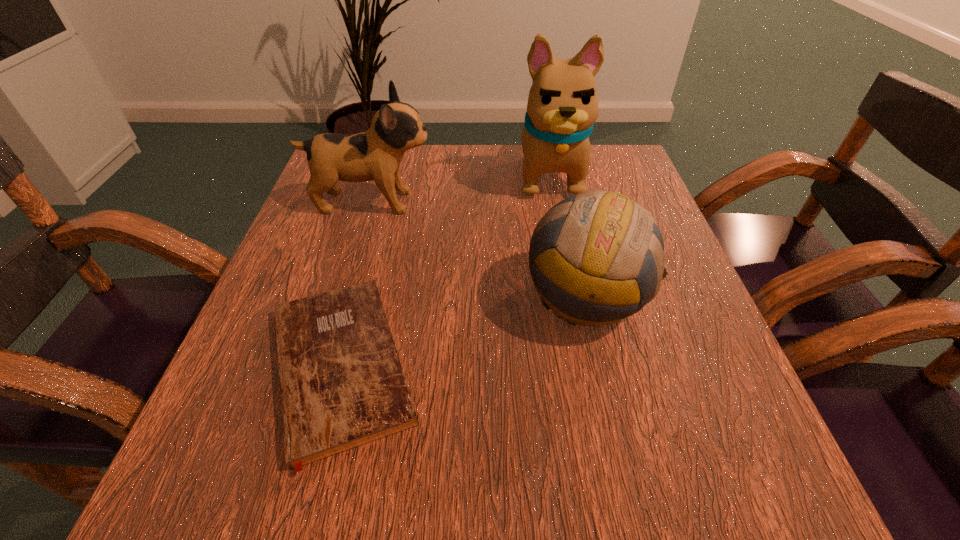
This screenshot has width=960, height=540. What are the coordinates of `vacant area that lies between the tallest object and the shortest object` in the screenshot? It's located at (444, 270).

Locate an element on the screen. free area in between the shorter puppy and the right puppy is located at coordinates pyautogui.click(x=460, y=188).

Identify which object is the third nearest to the right puppy. Please provide its 2D coordinates. Your answer should be formatted as a tuple, i.e. [(x, y)], where the tuple contains the x and y coordinates of a point satisfying the conditions above.

[(342, 385)]

Identify the location of the third closest object to the second shortest object. (376, 154).

The image size is (960, 540). Identify the location of free space that satisfies the following two spatial constraints: 1. at the face of the third shortest object; 2. on the back side of the volleyball. click(343, 298).

At what (x,y) coordinates should I click in order to perform the action: click on blank area in the image that satisfies the following two spatial constraints: 1. at the face of the left puppy; 2. on the right side of the shortest object. Please return your answer as a coordinate pair (x, y). Looking at the image, I should click on (323, 366).

In order to click on vacant region that satisfies the following two spatial constraints: 1. on the face of the second shortest object; 2. on the right side of the taller puppy in this screenshot , I will do `click(574, 298)`.

Where is `vacant space that satisfies the following two spatial constraints: 1. on the face of the taller puppy; 2. at the face of the left puppy`? Image resolution: width=960 pixels, height=540 pixels. vacant space that satisfies the following two spatial constraints: 1. on the face of the taller puppy; 2. at the face of the left puppy is located at coordinates (555, 202).

At what (x,y) coordinates should I click in order to perform the action: click on vacant region that satisfies the following two spatial constraints: 1. on the face of the tallest object; 2. on the left side of the second shortest object. Please return your answer as a coordinate pair (x, y). The height and width of the screenshot is (540, 960). Looking at the image, I should click on (574, 298).

At what (x,y) coordinates should I click in order to perform the action: click on free spot that satisfies the following two spatial constraints: 1. on the back side of the shortest object; 2. at the face of the left puppy. Please return your answer as a coordinate pair (x, y). The width and height of the screenshot is (960, 540). Looking at the image, I should click on (384, 202).